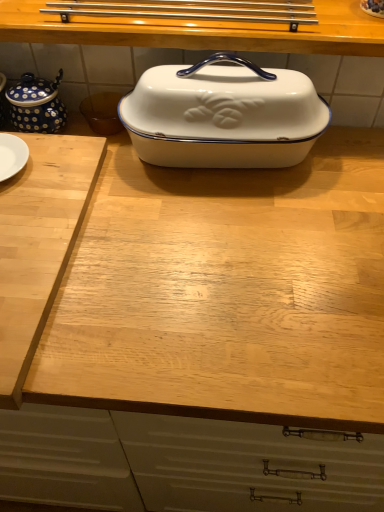
Find the location of a particular element. This screenshot has width=384, height=512. free point in front of blue dotted ceramic tea pot at left is located at coordinates (51, 164).